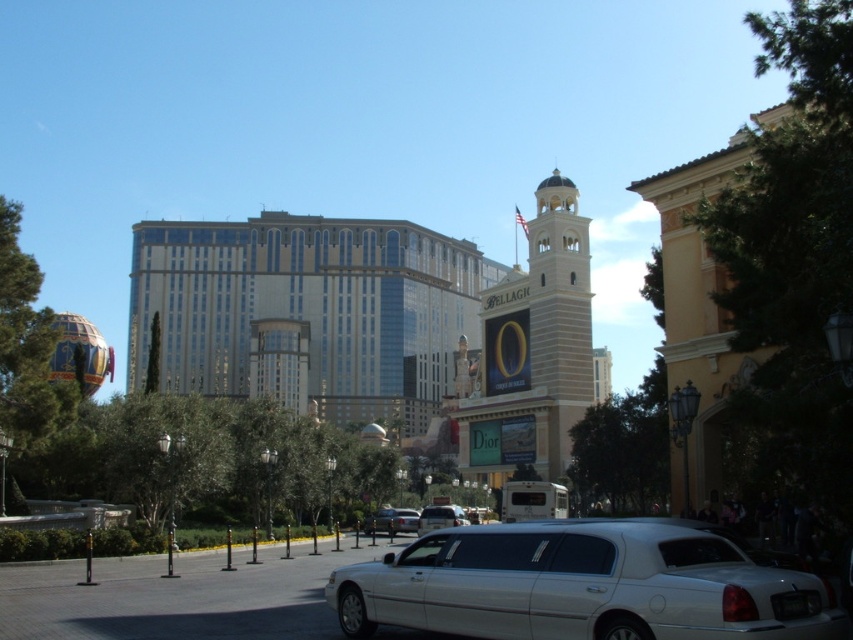
Based on the photo, is glassy metallic building at center positioned before white metallic car at center?

That is False.

Looking at this image, between glassy metallic building at center and white metallic car at center, which one appears on the left side from the viewer's perspective?

Positioned to the left is glassy metallic building at center.

What do you see at coordinates (308, 310) in the screenshot? I see `glassy metallic building at center` at bounding box center [308, 310].

The height and width of the screenshot is (640, 853). Find the location of `glassy metallic building at center`. glassy metallic building at center is located at coordinates (308, 310).

Is white glossy limousine at lower center wider than silver metallic car at center?

Yes.

Is white glossy limousine at lower center bigger than silver metallic car at center?

Yes, white glossy limousine at lower center is bigger than silver metallic car at center.

Is point (469, 554) farther from viewer compared to point (389, 525)?

No, it is not.

Image resolution: width=853 pixels, height=640 pixels. Identify the location of white glossy limousine at lower center. (582, 586).

Based on the photo, is glassy metallic building at center behind white glossy limousine at lower center?

Yes, glassy metallic building at center is further from the viewer.

Is glassy metallic building at center above white glossy limousine at lower center?

Correct, glassy metallic building at center is located above white glossy limousine at lower center.

Which is in front, point (309, 385) or point (648, 573)?

Point (648, 573)

Find the location of `glassy metallic building at center`. glassy metallic building at center is located at coordinates (308, 310).